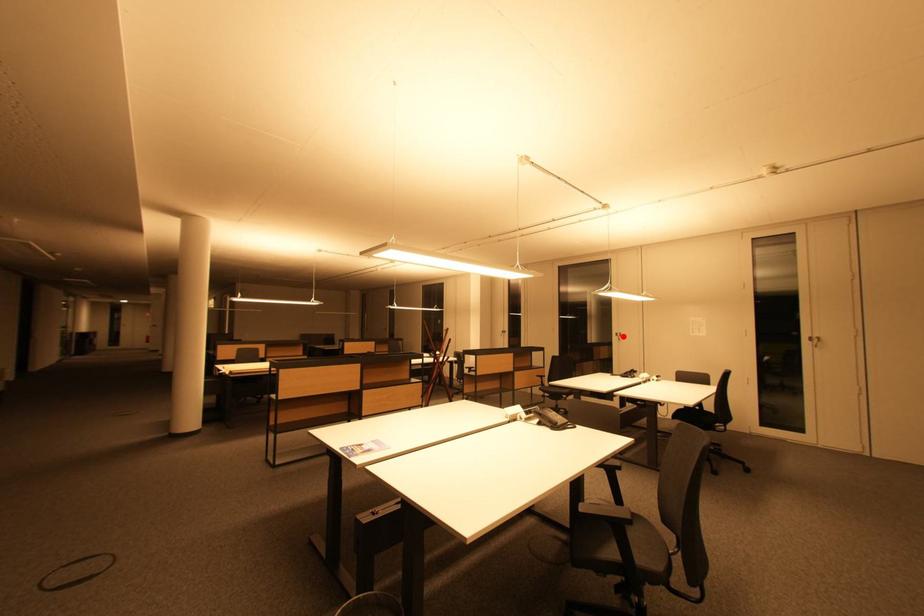
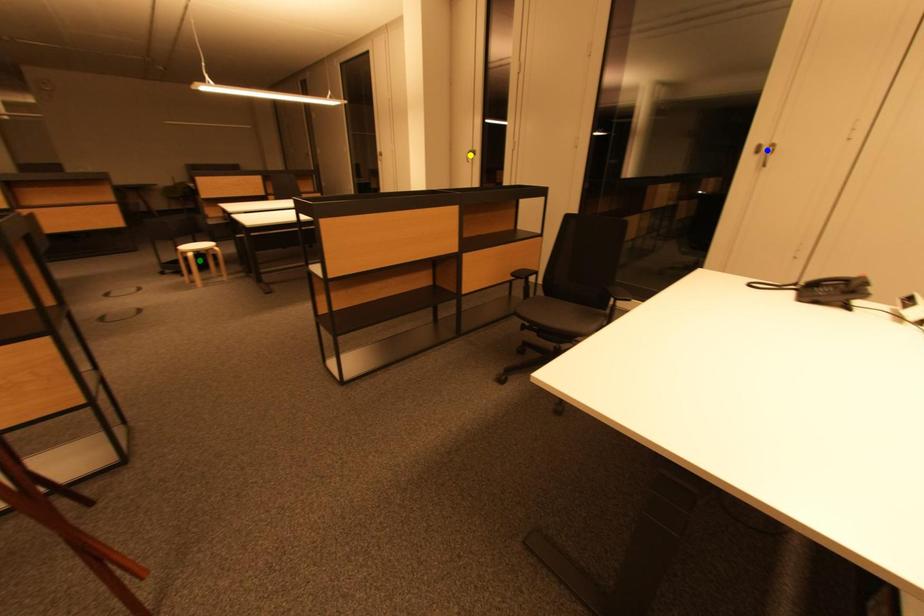
Question: I am providing you with two images of the same scene from different viewpoints. A red point is marked on the first image. You are given multiple points on the second image. Which point in image 2 represents the same 3d spot as the red point in image 1?

Choices:
 (A) green point
 (B) blue point
 (C) yellow point

Answer: (B)